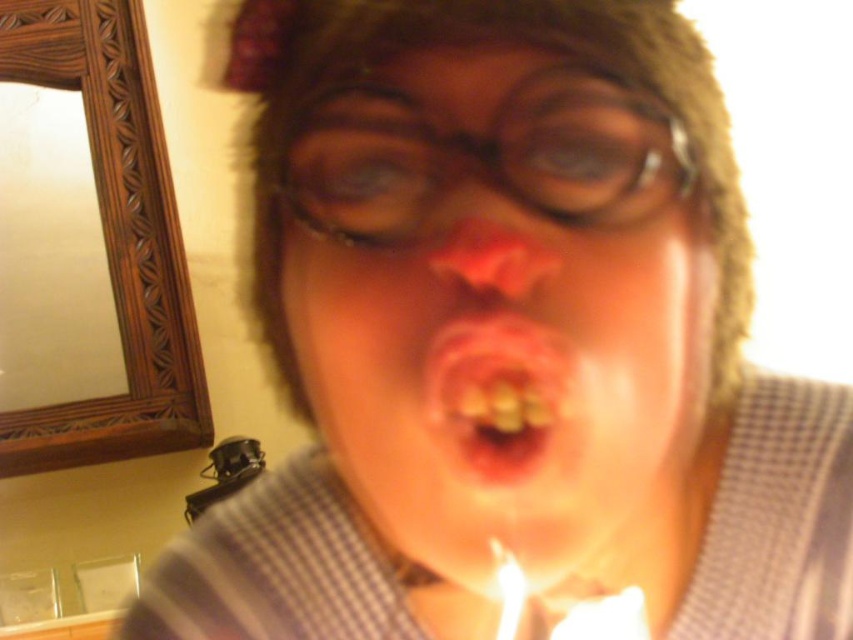
Question: From the image, what is the correct spatial relationship of black plastic glasses at center in relation to white wax candle at lower center?

Choices:
 (A) above
 (B) below

Answer: (A)

Question: Is the position of matte skin face at center less distant than that of white wax candle at lower center?

Choices:
 (A) yes
 (B) no

Answer: (A)

Question: Among these objects, which one is farthest from the camera?

Choices:
 (A) matte skin face at center
 (B) white wax candle at lower center
 (C) black plastic glasses at center
 (D) yellowish plastic teeth at center

Answer: (B)

Question: Which object is closer to the camera taking this photo?

Choices:
 (A) black plastic glasses at center
 (B) yellowish plastic teeth at center
 (C) white wax candle at lower center
 (D) matte skin face at center

Answer: (D)

Question: Can you confirm if matte skin face at center is smaller than black plastic glasses at center?

Choices:
 (A) no
 (B) yes

Answer: (A)

Question: Which of the following is the closest to the observer?

Choices:
 (A) (440, 337)
 (B) (517, 612)

Answer: (A)